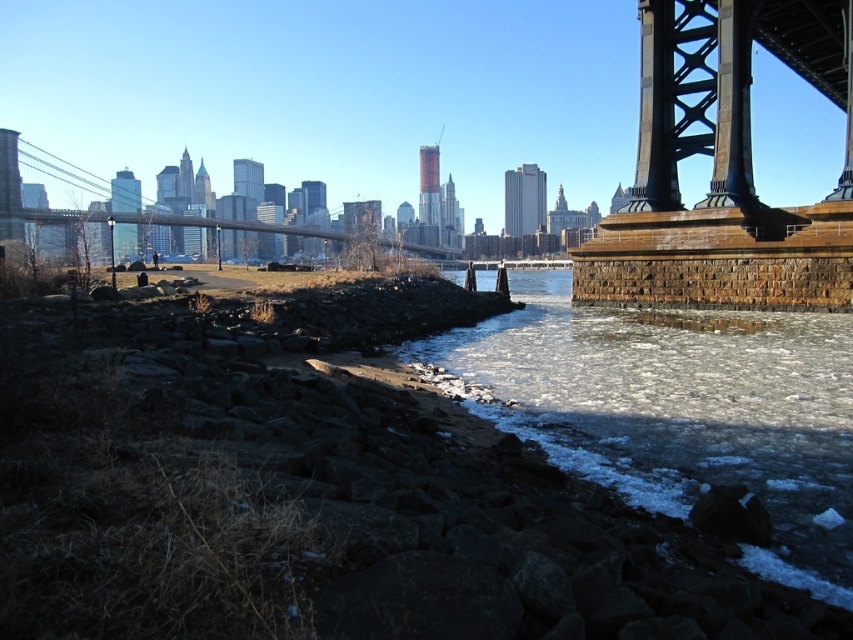
Which is above, frozen ice at lower left or metallic gray suspension bridge at left?

Positioned higher is metallic gray suspension bridge at left.

Does frozen ice at lower left have a greater width compared to metallic gray suspension bridge at left?

No, frozen ice at lower left is not wider than metallic gray suspension bridge at left.

Find the location of a particular element. The height and width of the screenshot is (640, 853). frozen ice at lower left is located at coordinates (676, 410).